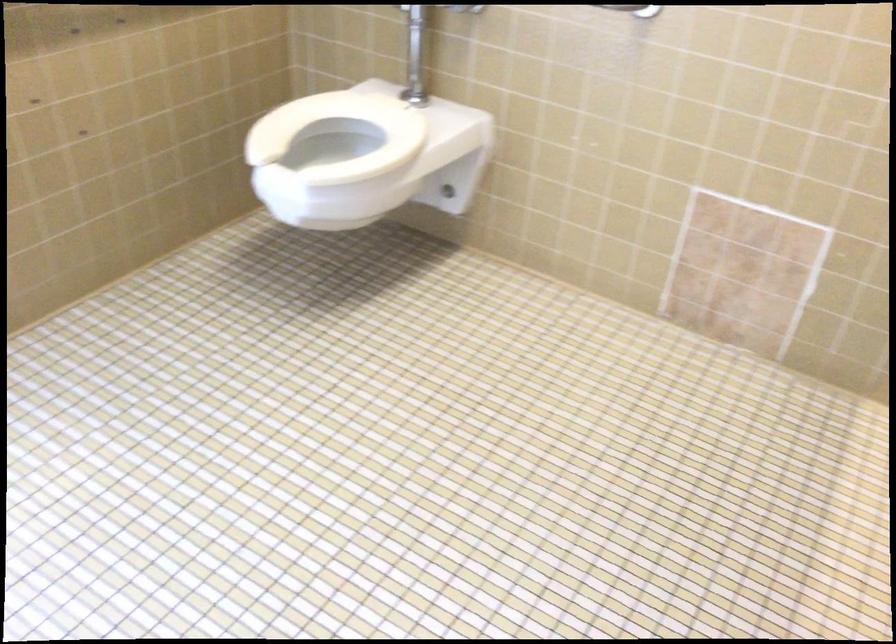
Find the location of a particular element. The height and width of the screenshot is (644, 896). metal grab bar is located at coordinates (415, 55).